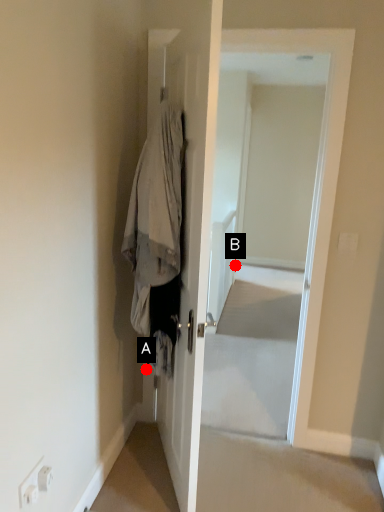
Question: Two points are circled on the image, labeled by A and B beside each circle. Among these points, which one is farthest from the camera?

Choices:
 (A) A is further
 (B) B is further

Answer: (B)